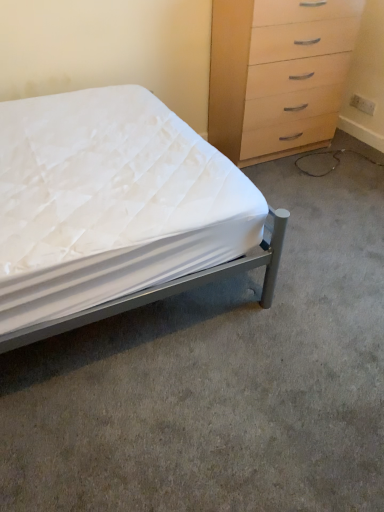
Question: Would you say light wood/wooden chest of drawers at upper right is inside or outside metallic gray bed at left?

Choices:
 (A) inside
 (B) outside

Answer: (B)

Question: From a real-world perspective, is light wood/wooden chest of drawers at upper right physically located above or below metallic gray bed at left?

Choices:
 (A) below
 (B) above

Answer: (B)

Question: Estimate the real-world distances between objects in this image. Which object is farther from the light wood/wooden chest of drawers at upper right?

Choices:
 (A) metallic gray bed at left
 (B) white fabric bed at lower left

Answer: (B)

Question: Considering the real-world distances, which object is closest to the white fabric bed at lower left?

Choices:
 (A) metallic gray bed at left
 (B) light wood/wooden chest of drawers at upper right

Answer: (A)